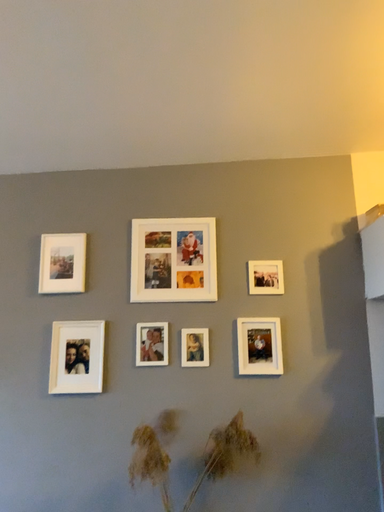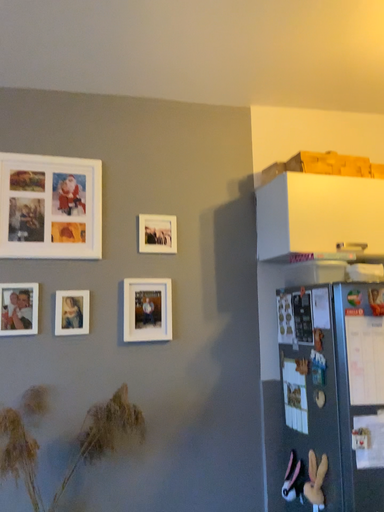
Question: How did the camera likely rotate when shooting the video?

Choices:
 (A) rotated left
 (B) rotated right

Answer: (B)